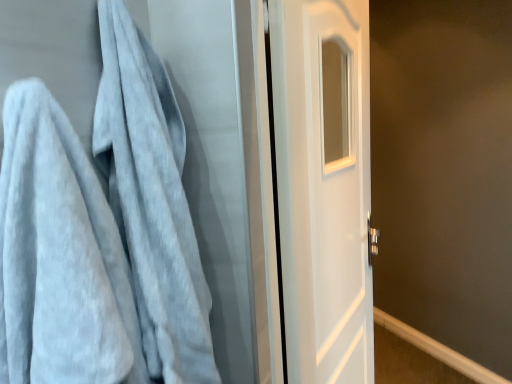
Question: From the image's perspective, does light gray plush towel at left appear lower than white glossy door at center?

Choices:
 (A) no
 (B) yes

Answer: (A)

Question: From a real-world perspective, is light gray plush towel at left physically above white glossy door at center?

Choices:
 (A) no
 (B) yes

Answer: (B)

Question: Considering the relative sizes of light gray plush towel at left and white glossy door at center in the image provided, is light gray plush towel at left bigger than white glossy door at center?

Choices:
 (A) no
 (B) yes

Answer: (A)

Question: Considering the relative sizes of light gray plush towel at left and white glossy door at center in the image provided, is light gray plush towel at left wider than white glossy door at center?

Choices:
 (A) no
 (B) yes

Answer: (B)

Question: Is light gray plush towel at left with white glossy door at center?

Choices:
 (A) no
 (B) yes

Answer: (A)

Question: Is light gray plush towel at left aimed at white glossy door at center?

Choices:
 (A) yes
 (B) no

Answer: (B)

Question: From the image's perspective, would you say white glossy door at center is positioned over light gray plush towel at left?

Choices:
 (A) yes
 (B) no

Answer: (B)

Question: Does white glossy door at center have a smaller size compared to light gray plush towel at left?

Choices:
 (A) yes
 (B) no

Answer: (B)

Question: Is white glossy door at center positioned with its back to light gray plush towel at left?

Choices:
 (A) yes
 (B) no

Answer: (B)

Question: Does white glossy door at center have a larger size compared to light gray plush towel at left?

Choices:
 (A) yes
 (B) no

Answer: (A)

Question: From a real-world perspective, does white glossy door at center sit lower than light gray plush towel at left?

Choices:
 (A) no
 (B) yes

Answer: (B)

Question: Is the depth of white glossy door at center greater than that of light gray plush towel at left?

Choices:
 (A) no
 (B) yes

Answer: (B)

Question: Visually, is light gray plush towel at left positioned to the left or to the right of white glossy door at center?

Choices:
 (A) left
 (B) right

Answer: (A)